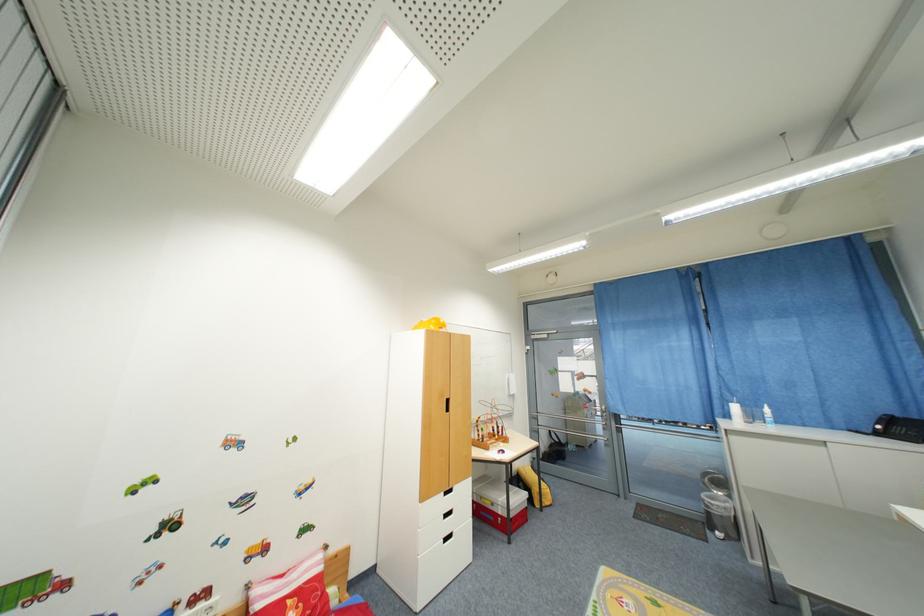
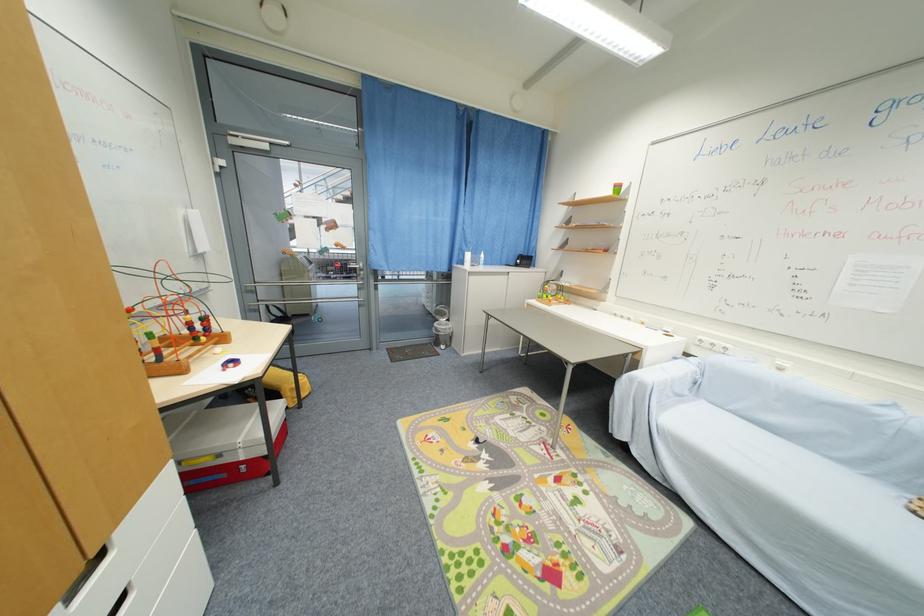
Find the pixel in the second image that matches the point at 733,418 in the first image.

(467, 264)